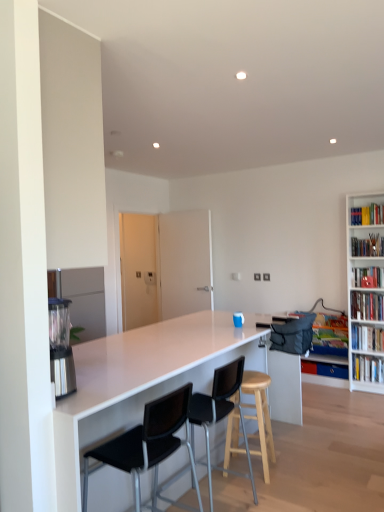
Question: Is black plastic chair at center, marked as the second chair in a back-to-front arrangement, at the left side of stainless steel blender at left?

Choices:
 (A) no
 (B) yes

Answer: (A)

Question: From a real-world perspective, is black plastic chair at center, marked as the second chair in a back-to-front arrangement, under stainless steel blender at left?

Choices:
 (A) no
 (B) yes

Answer: (B)

Question: From the image's perspective, is black plastic chair at center, the first chair when ordered from front to back, on stainless steel blender at left?

Choices:
 (A) no
 (B) yes

Answer: (A)

Question: Is black plastic chair at center, the first chair when ordered from front to back, wider than stainless steel blender at left?

Choices:
 (A) yes
 (B) no

Answer: (A)

Question: Does black plastic chair at center, marked as the second chair in a back-to-front arrangement, come behind stainless steel blender at left?

Choices:
 (A) yes
 (B) no

Answer: (B)

Question: Is point (233, 396) positioned closer to the camera than point (198, 385)?

Choices:
 (A) closer
 (B) farther

Answer: (B)

Question: Is light wood stool at center wider or thinner than white glossy countertop at center?

Choices:
 (A) thin
 (B) wide

Answer: (A)

Question: From a real-world perspective, is light wood stool at center physically located above or below white glossy countertop at center?

Choices:
 (A) above
 (B) below

Answer: (B)

Question: Based on their sizes in the image, would you say light wood stool at center is bigger or smaller than white glossy countertop at center?

Choices:
 (A) big
 (B) small

Answer: (B)

Question: From the image's perspective, is black plastic chair at center, acting as the first chair starting from the back, located above or below hardcover book at right, placed as the 2th book when sorted from bottom to top?

Choices:
 (A) above
 (B) below

Answer: (A)

Question: Choose the correct answer: Is black plastic chair at center, acting as the first chair starting from the back, inside hardcover book at right, placed as the 2th book when sorted from bottom to top, or outside it?

Choices:
 (A) inside
 (B) outside

Answer: (B)

Question: From a real-world perspective, is black plastic chair at center, arranged as the 2th chair when viewed from the front, physically located above or below hardcover book at right, placed as the 2th book when sorted from bottom to top?

Choices:
 (A) above
 (B) below

Answer: (A)

Question: Is black plastic chair at center, acting as the first chair starting from the back, wider or thinner than hardcover book at right, acting as the 6th book starting from the top?

Choices:
 (A) thin
 (B) wide

Answer: (B)

Question: Is hardcover book at upper right, which is the 3th book from top to bottom, taller or shorter than white matte bookshelf at right, acting as the 4th book starting from the top?

Choices:
 (A) short
 (B) tall

Answer: (A)

Question: Is hardcover book at upper right, the fifth book when ordered from bottom to top, spatially inside white matte bookshelf at right, which appears as the 4th book when ordered from the bottom, or outside of it?

Choices:
 (A) inside
 (B) outside

Answer: (B)